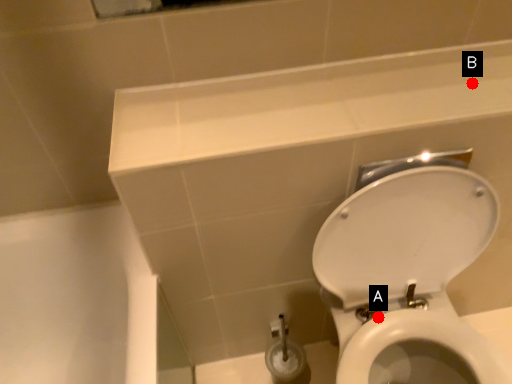
Question: Two points are circled on the image, labeled by A and B beside each circle. Which point is farther from the camera taking this photo?

Choices:
 (A) A is further
 (B) B is further

Answer: (A)